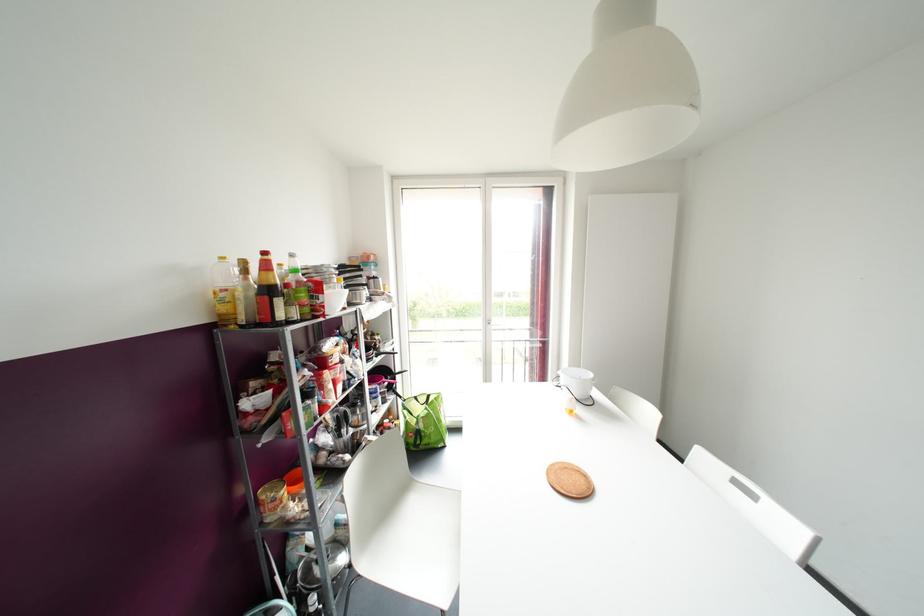
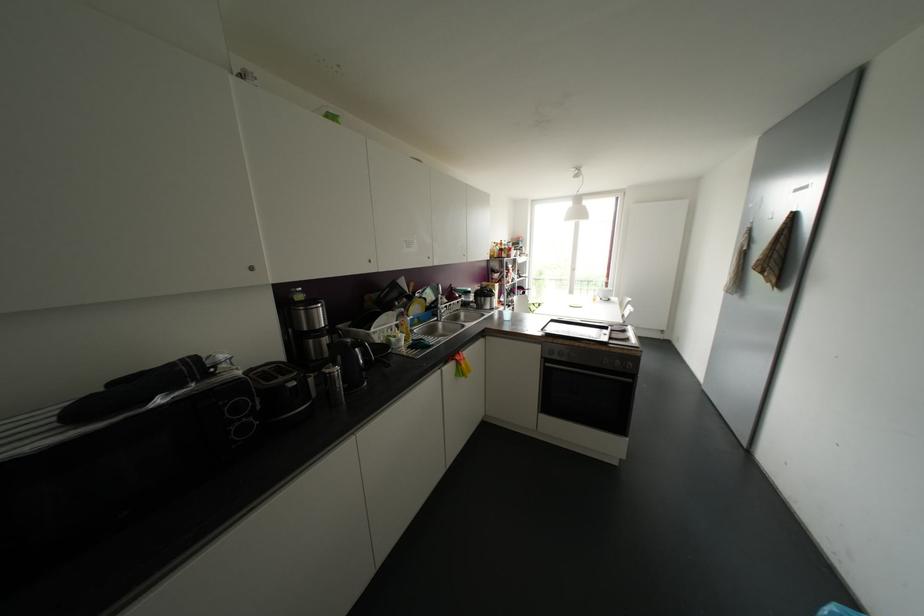
Question: The images are taken continuously from a first-person perspective. In which direction are you moving?

Choices:
 (A) Left
 (B) Right
 (C) Forward
 (D) Backward

Answer: (D)